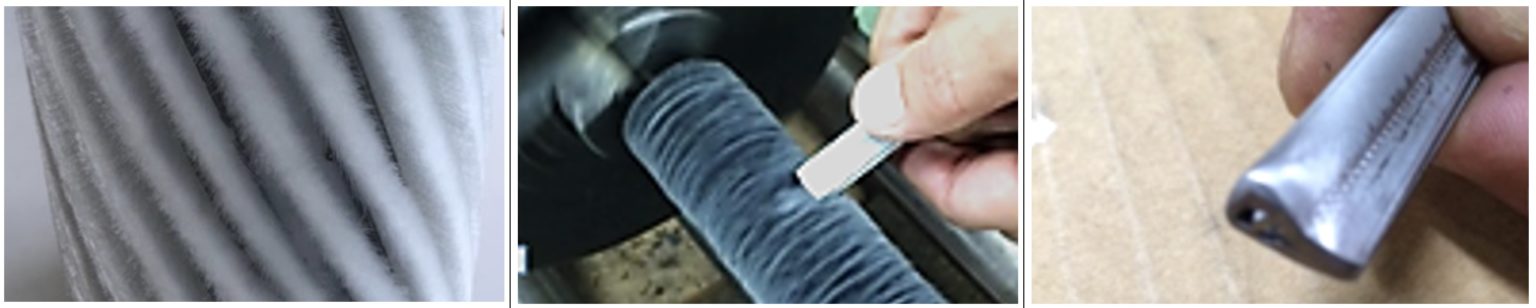
Where is `table`? table is located at coordinates (1101, 109).